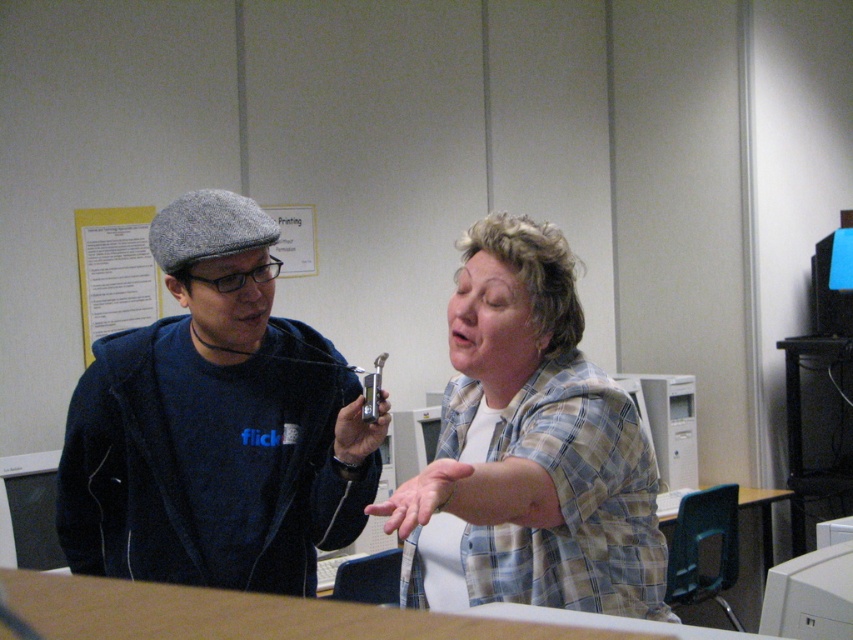
Does dark blue fabric sweatshirt at left appear under plaid shirt at center?

Indeed, dark blue fabric sweatshirt at left is positioned under plaid shirt at center.

Where is `dark blue fabric sweatshirt at left`? Image resolution: width=853 pixels, height=640 pixels. dark blue fabric sweatshirt at left is located at coordinates (215, 424).

Is point (167, 372) positioned after point (537, 488)?

Yes, it is behind point (537, 488).

The image size is (853, 640). Find the location of `dark blue fabric sweatshirt at left`. dark blue fabric sweatshirt at left is located at coordinates (215, 424).